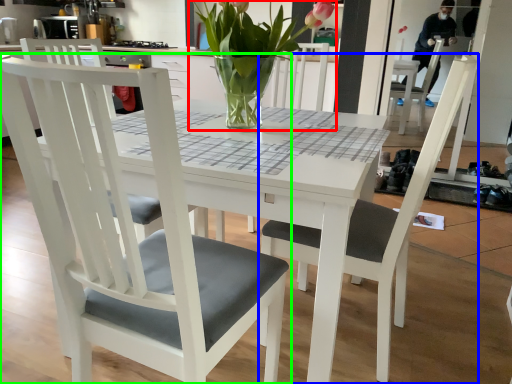
Question: Which object is the farthest from houseplant (highlighted by a red box)? Choose among these: chair (highlighted by a blue box) or chair (highlighted by a green box).

Choices:
 (A) chair
 (B) chair

Answer: (B)